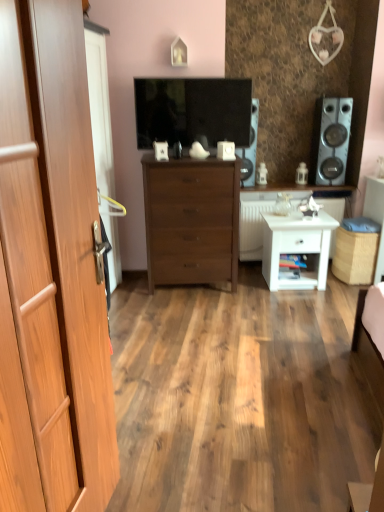
Question: From a real-world perspective, is satin silver speaker at right, the 2th speaker from the left, on top of wooden cabinet at center, which is the second counter top in bottom-to-top order?

Choices:
 (A) no
 (B) yes

Answer: (B)

Question: Considering the relative positions of satin silver speaker at right, the 2th speaker from the left, and wooden cabinet at center, which is the second counter top in bottom-to-top order, in the image provided, is satin silver speaker at right, the 2th speaker from the left, behind wooden cabinet at center, which is the second counter top in bottom-to-top order,?

Choices:
 (A) no
 (B) yes

Answer: (A)

Question: From the image's perspective, does satin silver speaker at right, the 2th speaker from the left, appear higher than wooden cabinet at center, which is the second counter top in bottom-to-top order?

Choices:
 (A) no
 (B) yes

Answer: (B)

Question: Is satin silver speaker at right, placed as the first speaker when sorted from right to left, positioned beyond the bounds of wooden cabinet at center, the 1th counter top when ordered from top to bottom?

Choices:
 (A) yes
 (B) no

Answer: (A)

Question: Is satin silver speaker at right, the 2th speaker from the left, taller than wooden cabinet at center, the 1th counter top when ordered from top to bottom?

Choices:
 (A) yes
 (B) no

Answer: (A)

Question: From a real-world perspective, relative to matte black tv at center, is white glossy side table at center right, marked as the 1th counter top in a bottom-to-top arrangement, vertically above or below?

Choices:
 (A) above
 (B) below

Answer: (B)

Question: From the image's perspective, is white glossy side table at center right, marked as the 1th counter top in a bottom-to-top arrangement, located above or below matte black tv at center?

Choices:
 (A) below
 (B) above

Answer: (A)

Question: Is point (316, 192) positioned closer to the camera than point (150, 102)?

Choices:
 (A) farther
 (B) closer

Answer: (A)

Question: Is white glossy side table at center right, marked as the 1th counter top in a bottom-to-top arrangement, situated inside matte black tv at center or outside?

Choices:
 (A) outside
 (B) inside

Answer: (A)

Question: From the image's perspective, is matte black speaker at center, placed as the 1th speaker when sorted from left to right, located above or below brown wooden chest of drawers at center?

Choices:
 (A) below
 (B) above

Answer: (B)

Question: Looking at their shapes, would you say matte black speaker at center, which ranks as the second speaker in right-to-left order, is wider or thinner than brown wooden chest of drawers at center?

Choices:
 (A) wide
 (B) thin

Answer: (B)

Question: Visually, is matte black speaker at center, placed as the 1th speaker when sorted from left to right, positioned to the left or to the right of brown wooden chest of drawers at center?

Choices:
 (A) left
 (B) right

Answer: (B)

Question: Relative to brown wooden chest of drawers at center, is matte black speaker at center, which ranks as the second speaker in right-to-left order, in front or behind?

Choices:
 (A) behind
 (B) front

Answer: (A)

Question: In the image, is white matte nightstand at lower right positioned in front of or behind light brown wood door at left?

Choices:
 (A) behind
 (B) front

Answer: (A)

Question: Considering the relative positions of white matte nightstand at lower right and light brown wood door at left in the image provided, is white matte nightstand at lower right to the left or to the right of light brown wood door at left?

Choices:
 (A) right
 (B) left

Answer: (A)